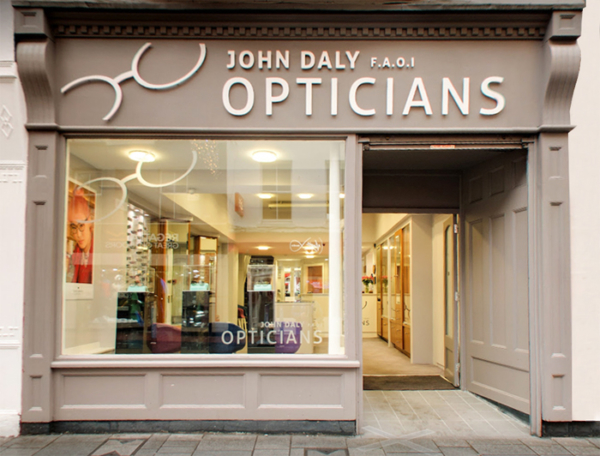
Where is `counter`? counter is located at coordinates (289, 304).